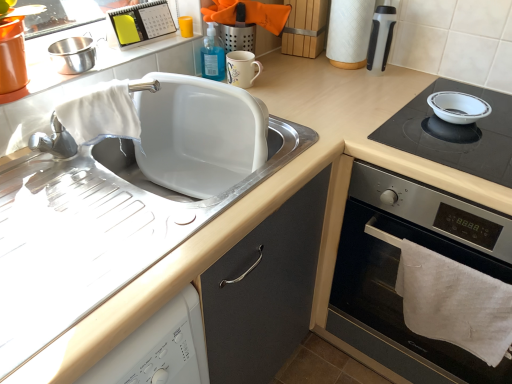
I want to click on vacant area that is in front of matte ceramic mug at upper center, the 2th appliance in the right-to-left sequence, so click(267, 115).